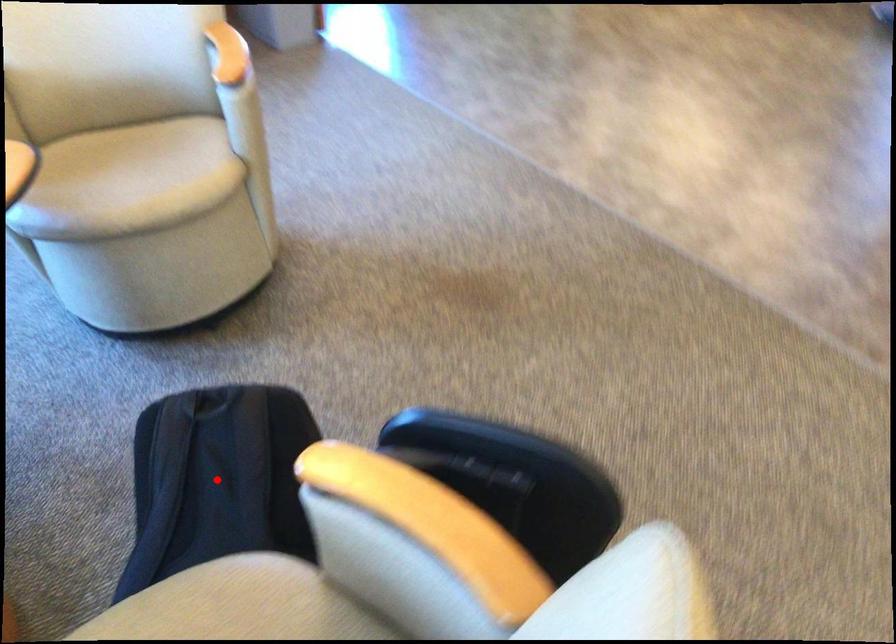
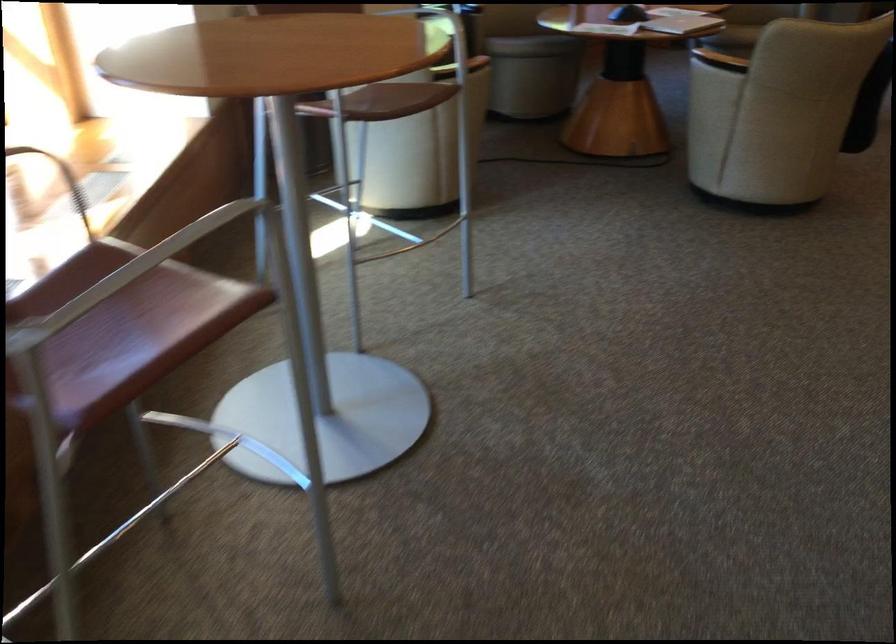
Question: I am providing you with two images of the same scene from different viewpoints. A red point is marked on the first image. Can you still see the location of the red point in image 2?

Choices:
 (A) Yes
 (B) No

Answer: (B)